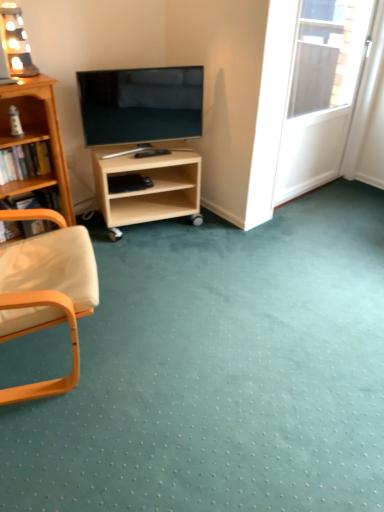
This screenshot has height=512, width=384. Find the location of `vacant space to the right of wooden bookcase at left`. vacant space to the right of wooden bookcase at left is located at coordinates (108, 248).